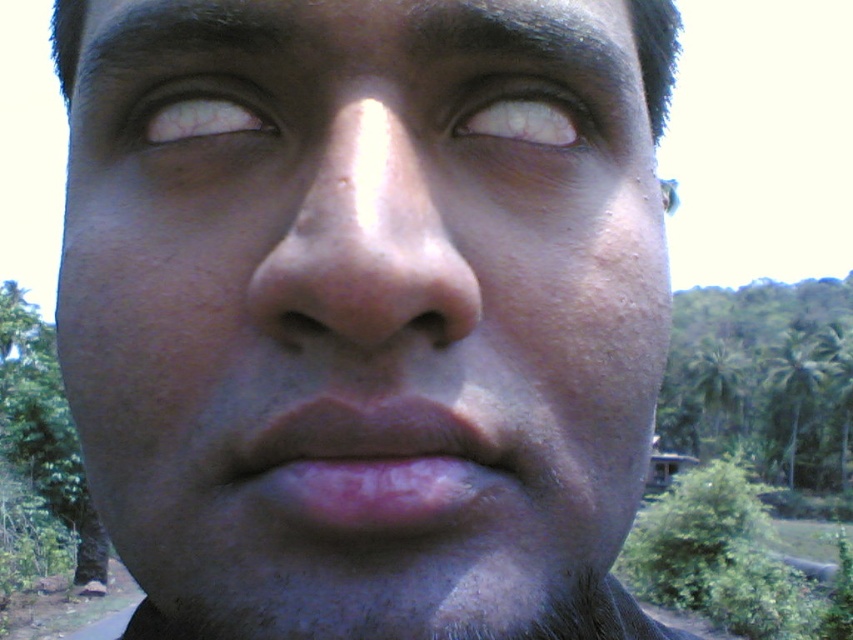
Question: Which of these objects is positioned closest to the smooth skin nose at center?

Choices:
 (A) white matte eye at upper center
 (B) pink matte lips at center
 (C) pale skin eye at upper center
 (D) dark brown hair at upper center

Answer: (B)

Question: Which is nearer to the smooth skin nose at center?

Choices:
 (A) white matte eye at upper center
 (B) pink matte lips at center
 (C) dark brown hair at upper center
 (D) smooth skin face at center

Answer: (B)

Question: Can you confirm if smooth skin face at center is positioned to the right of pink matte lips at center?

Choices:
 (A) no
 (B) yes

Answer: (B)

Question: Which point is closer to the camera taking this photo?

Choices:
 (A) (490, 129)
 (B) (444, 424)

Answer: (B)

Question: Can you confirm if white matte eye at upper center is positioned above pale skin eye at upper center?

Choices:
 (A) yes
 (B) no

Answer: (B)

Question: Is white matte eye at upper center bigger than dark brown hair at upper center?

Choices:
 (A) no
 (B) yes

Answer: (A)